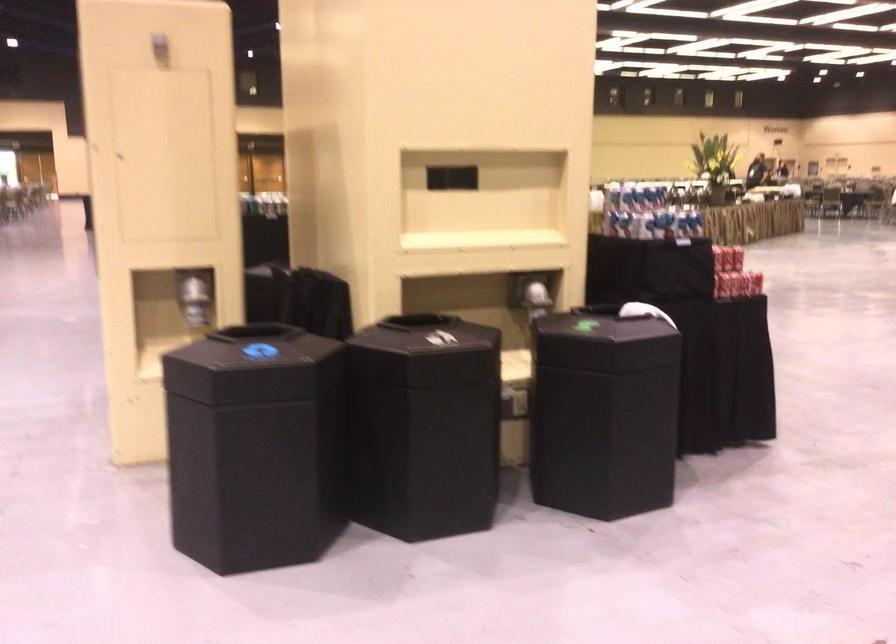
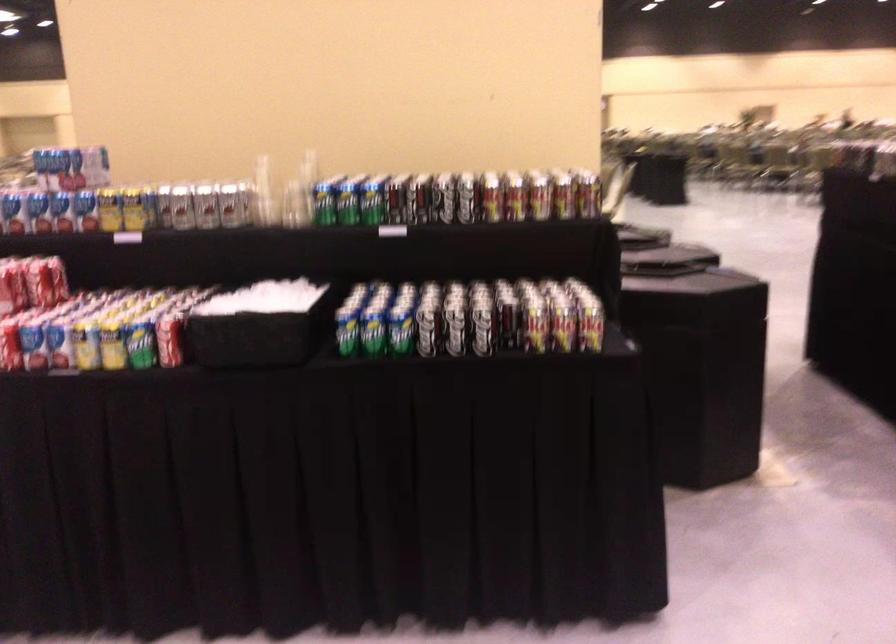
Question: I am providing you with two images of the same scene from different viewpoints. Please identify which objects are invisible in image2.

Choices:
 (A) black bin lid
 (B) clear plastic cup
 (C) teal pillow
 (D) silver soda can

Answer: (A)